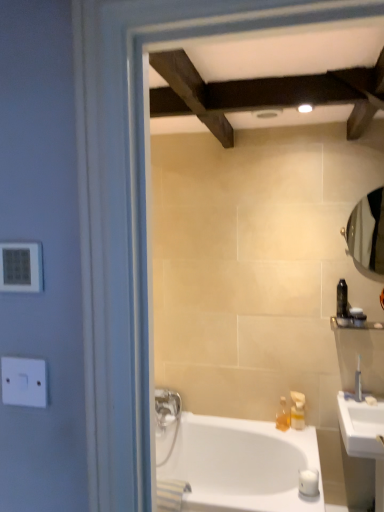
You are a GUI agent. You are given a task and a screenshot of the screen. Output one action in this format:
    pyautogui.click(x=<x>, y=<y>)
    Task: Click on the vacant area situated to the left side of translucent plastic soap dispenser at lower right
    This screenshot has height=512, width=384.
    Given the screenshot: What is the action you would take?
    pyautogui.click(x=262, y=425)